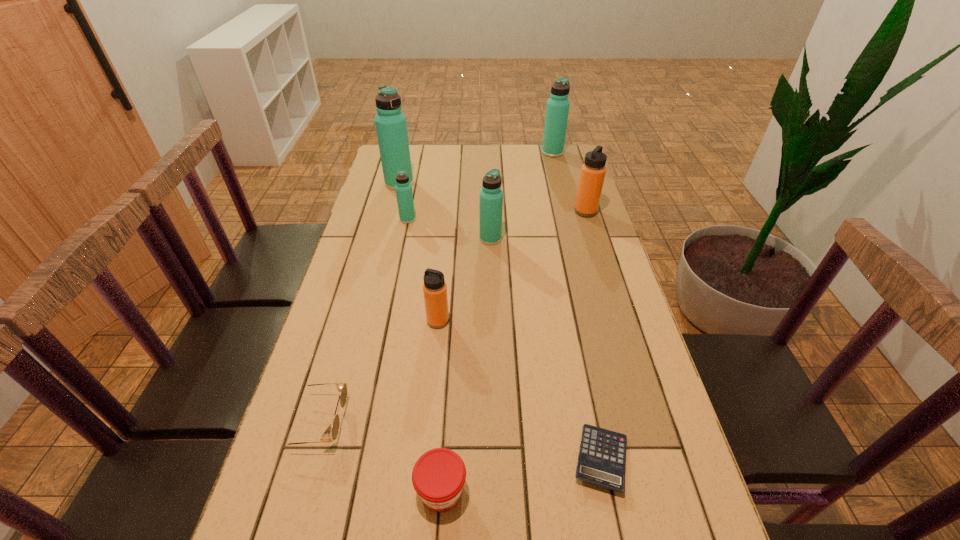
Locate an element on the screen. The image size is (960, 540). the smaller orange thermos bottle is located at coordinates (434, 288).

The height and width of the screenshot is (540, 960). In order to click on the seventh tallest object in this screenshot , I will do `click(438, 476)`.

What are the coordinates of `jam` in the screenshot? It's located at (438, 476).

Identify the location of sunglasses. This screenshot has height=540, width=960. (342, 387).

Identify the location of calculator. (601, 461).

The width and height of the screenshot is (960, 540). In order to click on free space located on the back of the second farthest object in this screenshot , I will do `click(404, 165)`.

Image resolution: width=960 pixels, height=540 pixels. Identify the location of vacant space located 0.230m on the front of the farthest aqua thermos bottle. (562, 187).

Where is `free location located on the left of the farther orange thermos bottle`? free location located on the left of the farther orange thermos bottle is located at coordinates (494, 212).

The image size is (960, 540). Identify the location of free point located 0.380m on the front of the fifth farthest object. (493, 339).

Image resolution: width=960 pixels, height=540 pixels. In order to click on vacant region located on the right of the smallest aqua thermos bottle in this screenshot , I will do `click(494, 219)`.